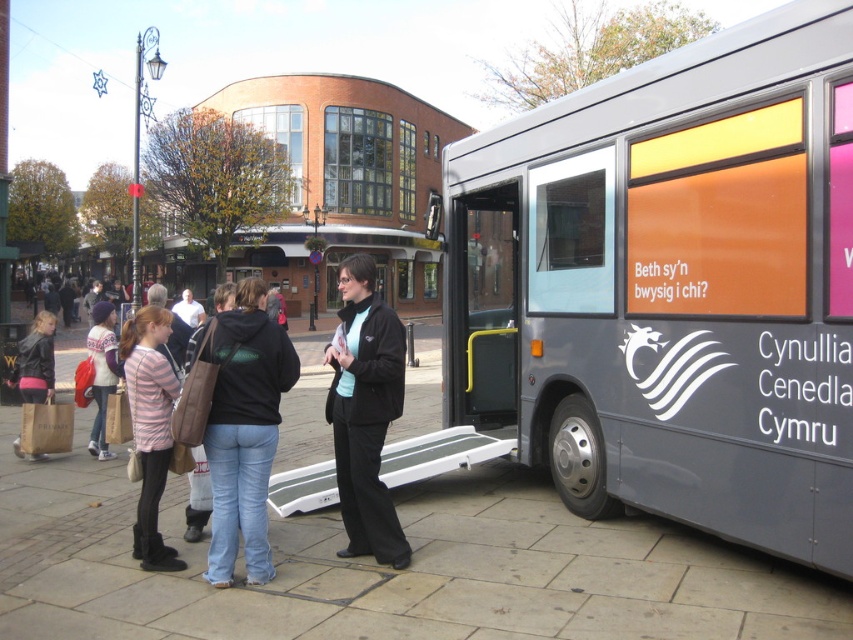
You are a passenger waiting at the station and see the silver metallic bus at right and the black matte jacket at center. Which object is closer to you?

The silver metallic bus at right is closer to you because it is in front of the black matte jacket at center.

You are a passenger at the bus stop and want to board the silver metallic bus at right. You are currently standing next to the black matte jacket at center. Which direction should you walk to reach the bus?

The silver metallic bus at right is to the right of the black matte jacket at center, so you should walk to your right to reach the bus.